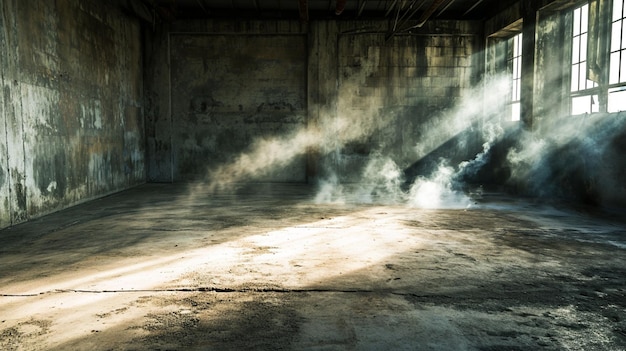
Find the location of a particular element. Image resolution: width=626 pixels, height=351 pixels. room is located at coordinates (x=255, y=114).